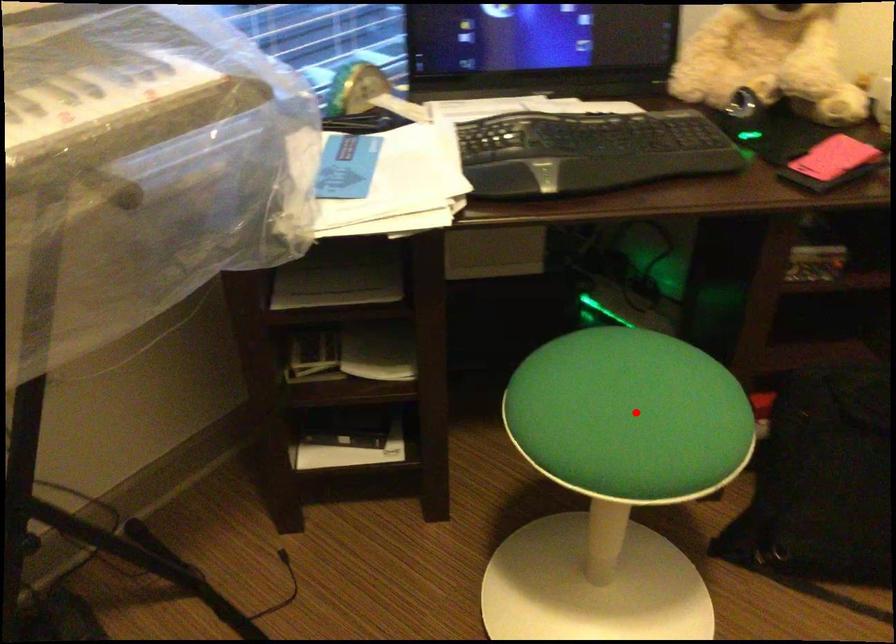
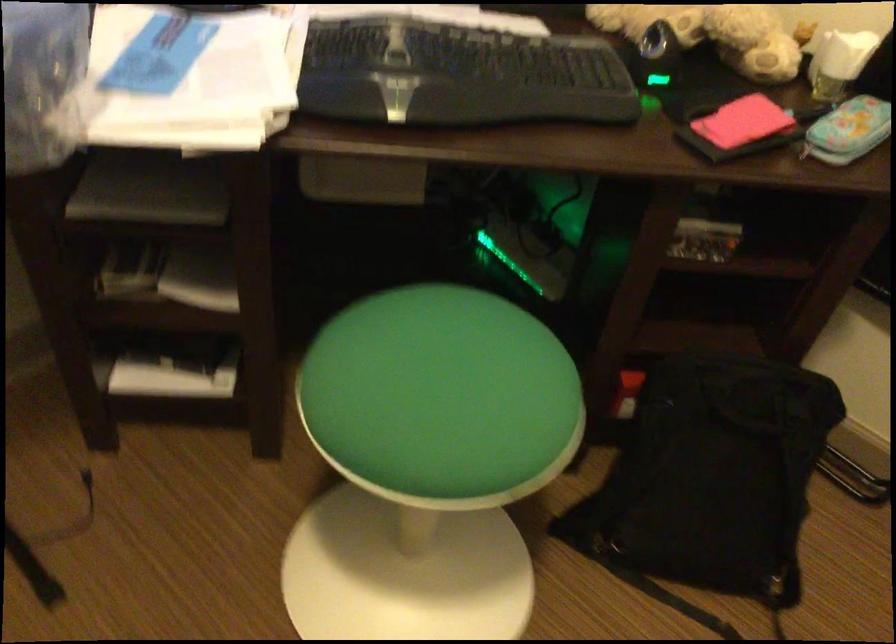
In the second image, find the point that corresponds to the highlighted location in the first image.

(441, 398)